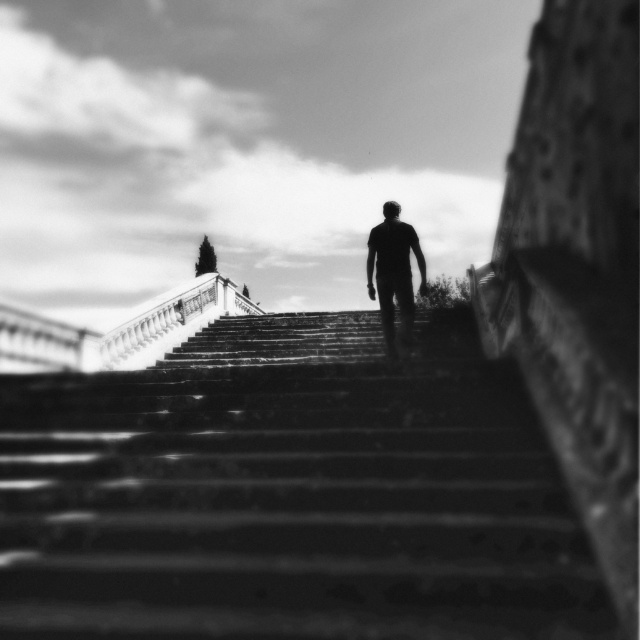
Question: Does smooth stone stairs at center have a larger size compared to silhouette figure at center?

Choices:
 (A) no
 (B) yes

Answer: (B)

Question: Does smooth stone stairs at center have a smaller size compared to silhouette figure at center?

Choices:
 (A) yes
 (B) no

Answer: (B)

Question: Is smooth stone stairs at center positioned in front of silhouette figure at center?

Choices:
 (A) no
 (B) yes

Answer: (B)

Question: Which point is closer to the camera taking this photo?

Choices:
 (A) (86, 593)
 (B) (390, 248)

Answer: (A)

Question: Which point is closer to the camera?

Choices:
 (A) smooth stone stairs at center
 (B) silhouette figure at center

Answer: (A)